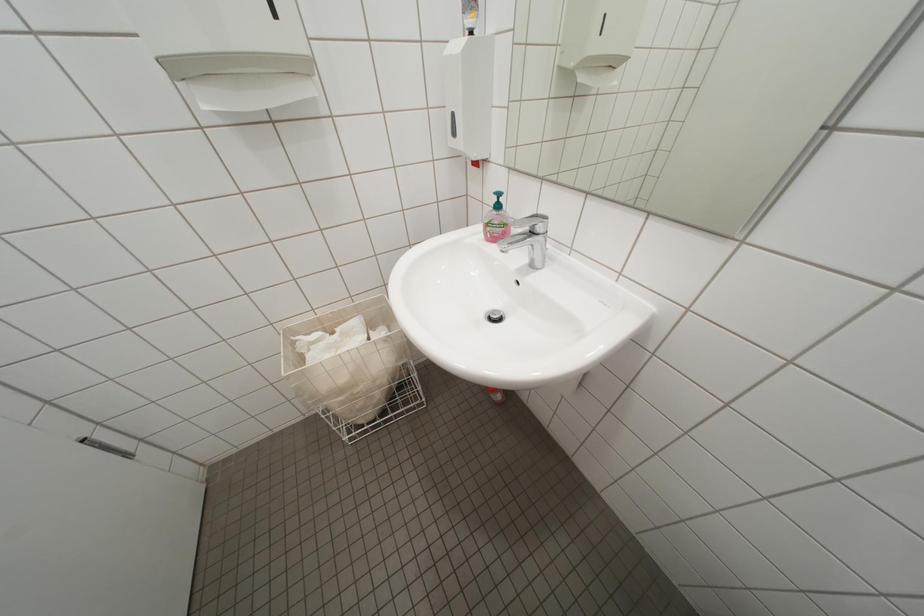
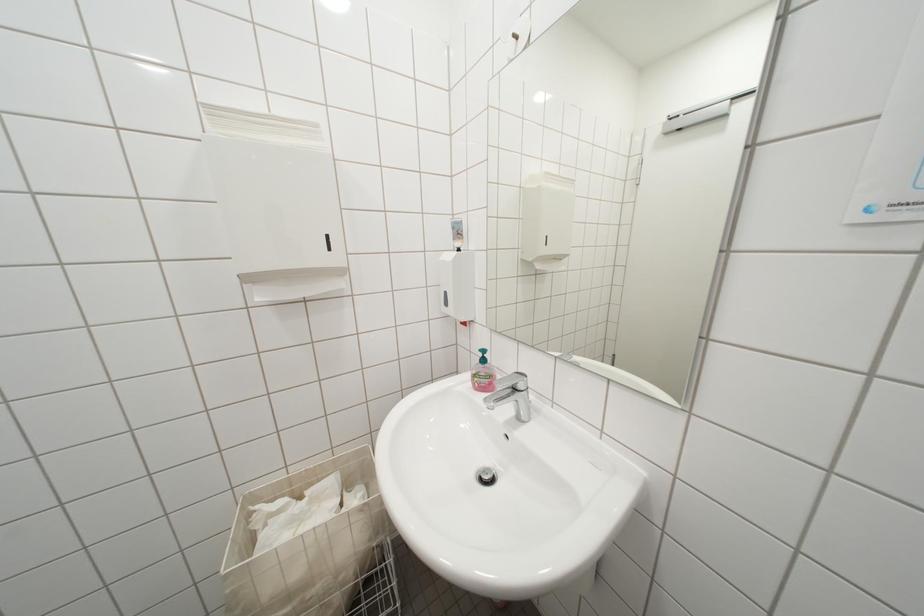
Question: Which direction would the cameraman need to move to produce the second image? Reply with the corresponding letter.

Choices:
 (A) Left
 (B) Right
 (C) Forward
 (D) Backward

Answer: (D)